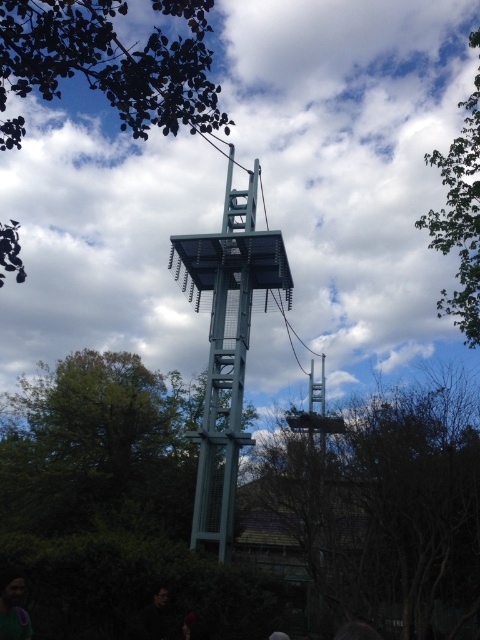
Is point (469, 214) positioned before point (26, 636)?

No, (469, 214) is further to viewer.

Can you confirm if green leafy tree at upper right is taller than purple fabric at lower left?

Yes.

The width and height of the screenshot is (480, 640). Find the location of `green leafy tree at upper right`. green leafy tree at upper right is located at coordinates (459, 220).

Which is more to the right, brown leafy tree at center or metallic gray bell tower at center?

brown leafy tree at center is more to the right.

Between brown leafy tree at center and metallic gray bell tower at center, which one has more height?

Standing taller between the two is metallic gray bell tower at center.

This screenshot has width=480, height=640. I want to click on brown leafy tree at center, so click(384, 509).

Does metallic gray bell tower at center appear on the left side of green leafy tree at upper right?

Correct, you'll find metallic gray bell tower at center to the left of green leafy tree at upper right.

Who is more forward, (210, 525) or (450, 145)?

Point (210, 525) is in front.

The width and height of the screenshot is (480, 640). In order to click on metallic gray bell tower at center in this screenshot , I will do `click(227, 342)`.